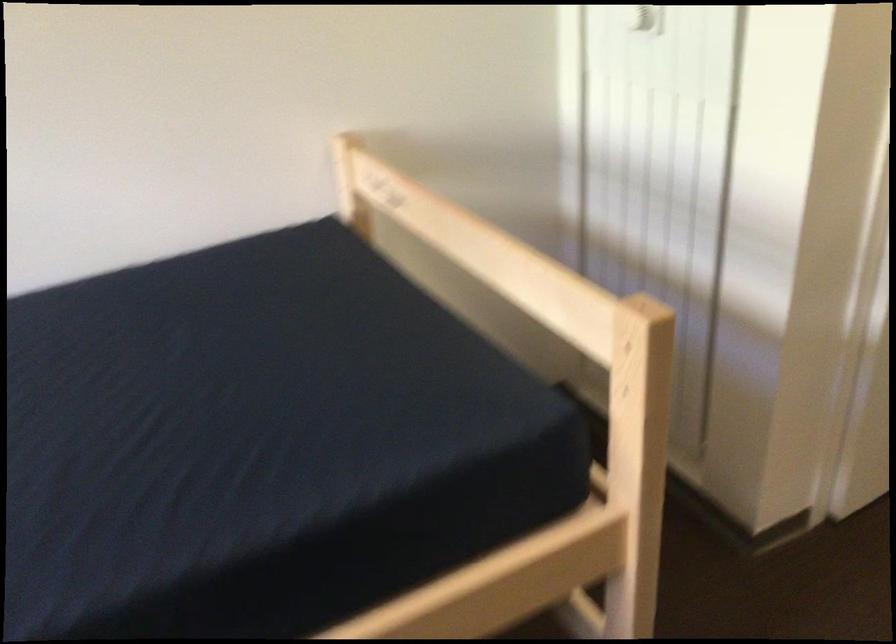
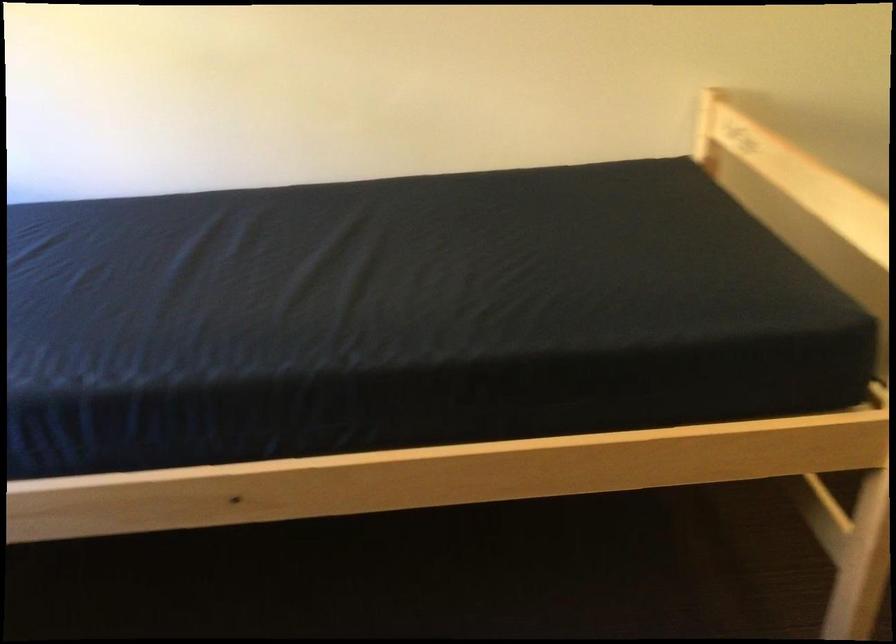
Question: The camera is either moving clockwise (left) or counter-clockwise (right) around the object. The first image is from the beginning of the video and the second image is from the end. Is the camera moving left or right when shooting the video?

Choices:
 (A) Left
 (B) Right

Answer: (B)